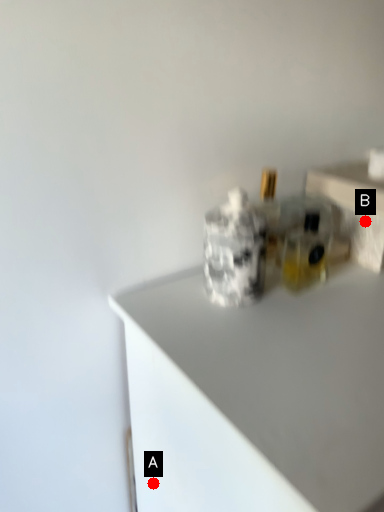
Question: Two points are circled on the image, labeled by A and B beside each circle. Which of the following is the closest to the observer?

Choices:
 (A) A is closer
 (B) B is closer

Answer: (B)